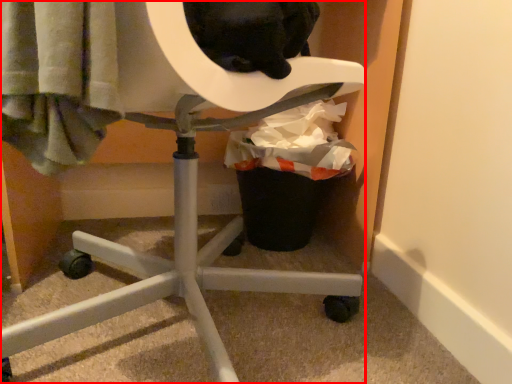
Question: From the image, what is the correct spatial relationship of furniture (annotated by the red box) in relation to garbage?

Choices:
 (A) left
 (B) right

Answer: (A)